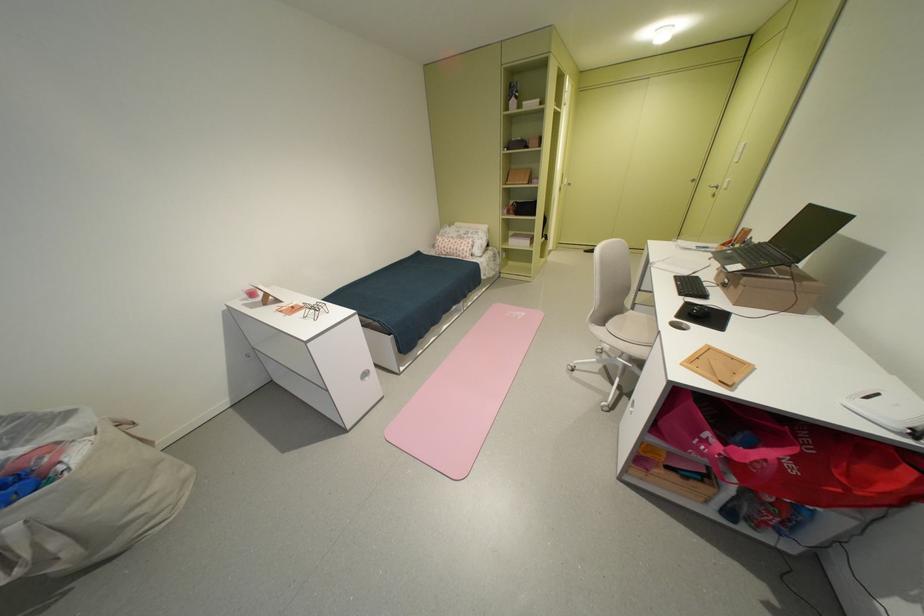
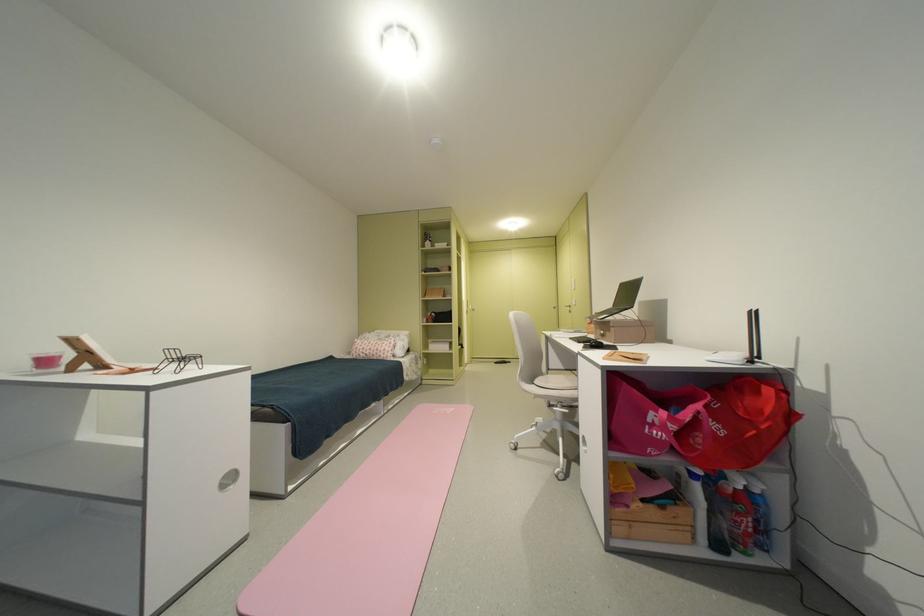
The point at (615,326) is marked in the first image. Where is the corresponding point in the second image?

(543, 383)